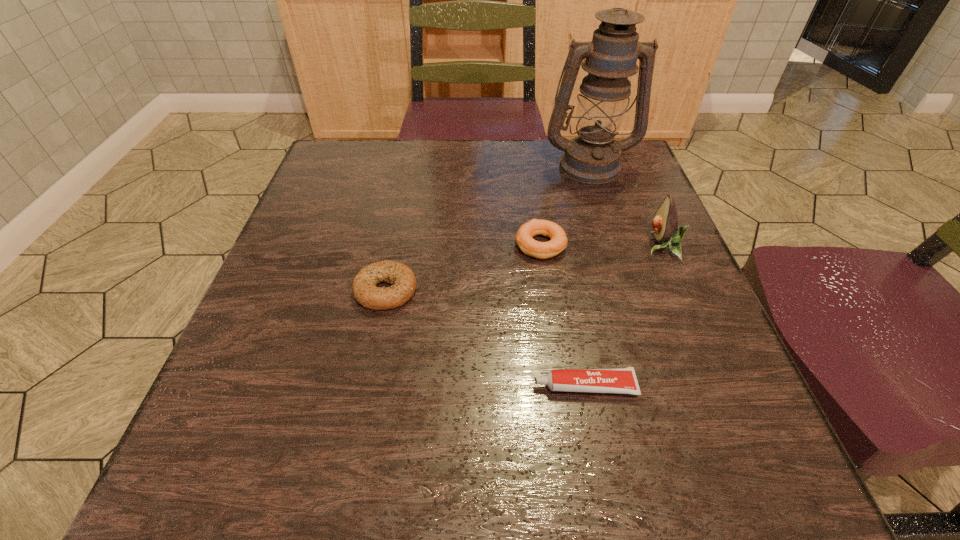
Find the location of `vacant area that lies between the nearest object and the second tallest object`. vacant area that lies between the nearest object and the second tallest object is located at coordinates (x=623, y=316).

Image resolution: width=960 pixels, height=540 pixels. In order to click on free space between the toothpaste and the left bagel in this screenshot , I will do `click(485, 338)`.

You are a GUI agent. You are given a task and a screenshot of the screen. Output one action in this format:
    pyautogui.click(x=<x>, y=<y>)
    Task: Click on the blank region between the right bagel and the fourth farthest object
    This screenshot has width=960, height=540.
    Given the screenshot: What is the action you would take?
    pyautogui.click(x=463, y=267)

The image size is (960, 540). Identify the location of free area in between the right bagel and the left bagel. (463, 267).

Find the location of a particular element. Image resolution: width=960 pixels, height=540 pixels. vacant space in between the avocado and the shortest object is located at coordinates (623, 316).

Where is `vacant region between the tallest object and the nearer bagel`? This screenshot has height=540, width=960. vacant region between the tallest object and the nearer bagel is located at coordinates (488, 228).

Find the location of a particular element. free spot between the avocado and the shortest object is located at coordinates (623, 316).

Where is `free space between the avocado and the tallest object`? This screenshot has height=540, width=960. free space between the avocado and the tallest object is located at coordinates (625, 206).

Where is `the fourth closest object to the nearest object`? The image size is (960, 540). the fourth closest object to the nearest object is located at coordinates (592, 157).

Identify which object is located as the fourth nearest to the right bagel. Please provide its 2D coordinates. Your answer should be formatted as a tuple, i.e. [(x, y)], where the tuple contains the x and y coordinates of a point satisfying the conditions above.

[(623, 380)]